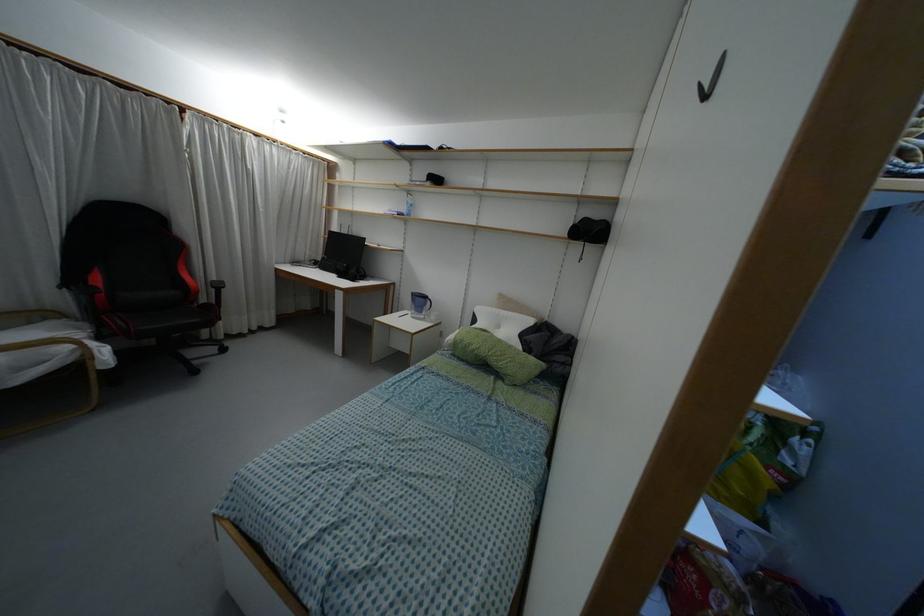
Where would you clos the black laptop? Please return your answer as a coordinate pair (x, y).

(343, 254)